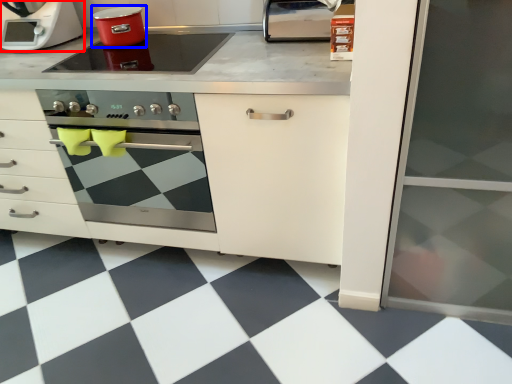
Question: Which object appears closest to the camera in this image, home appliance (highlighted by a red box) or kitchen appliance (highlighted by a blue box)?

Choices:
 (A) home appliance
 (B) kitchen appliance

Answer: (B)